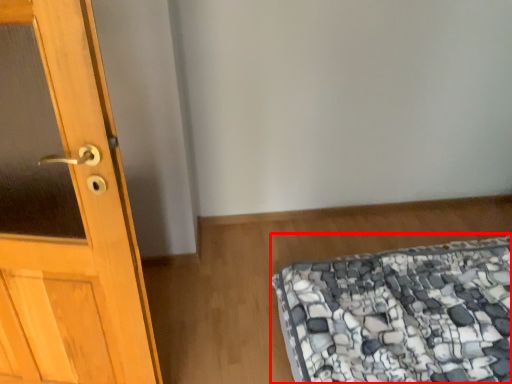
Question: From the image's perspective, what is the correct spatial positioning of mattress (annotated by the red box) in reference to door?

Choices:
 (A) above
 (B) below

Answer: (B)